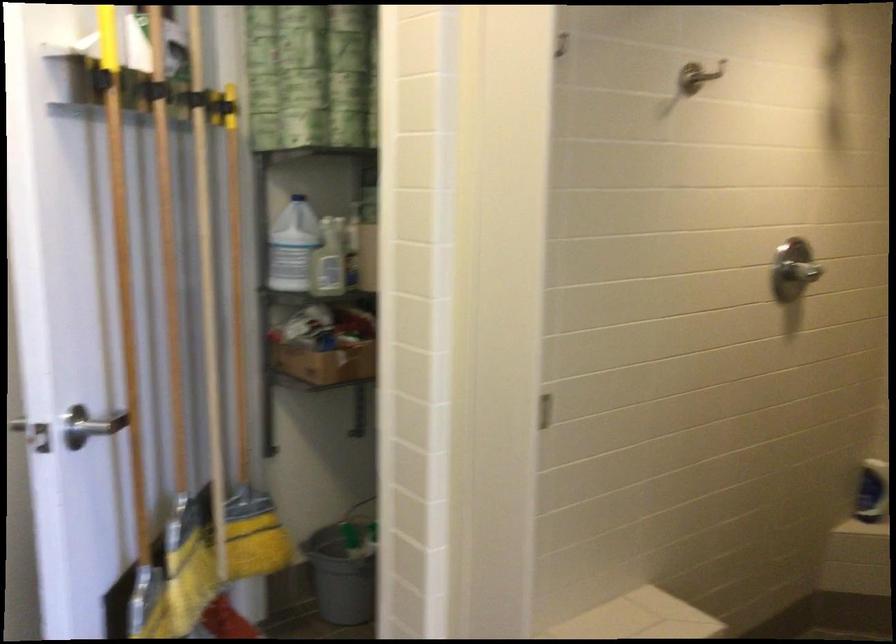
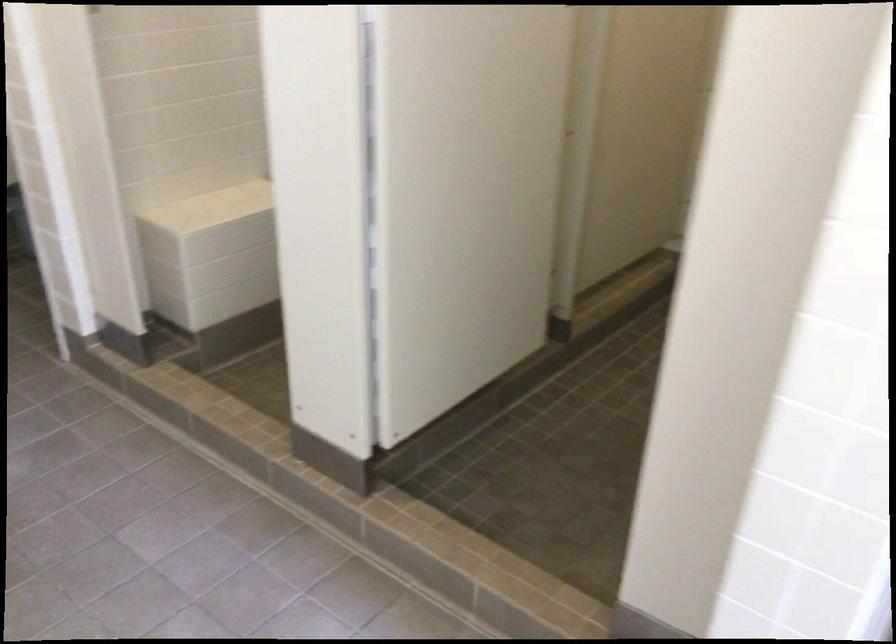
Which direction would the cameraman need to move to produce the second image?

The movement direction of the cameraman is right, backward.